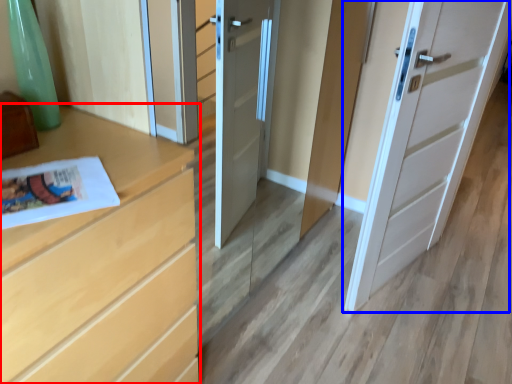
Question: Among these objects, which one is farthest to the camera, chest of drawers (highlighted by a red box) or door (highlighted by a blue box)?

Choices:
 (A) chest of drawers
 (B) door

Answer: (B)